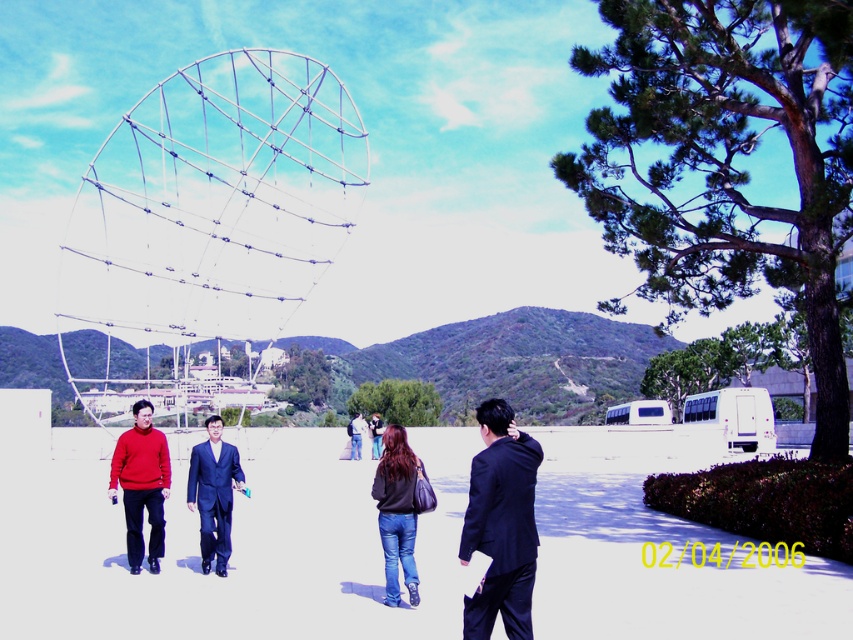
Between black suit at center and matte red sweater at lower left, which one is positioned higher?

black suit at center is higher up.

Is point (488, 628) farther from camera compared to point (157, 465)?

That is False.

Who is more forward, (500,570) or (144,484)?

Point (500,570)

Locate an element on the screen. black suit at center is located at coordinates (502, 524).

Can you confirm if matte red sweater at lower left is shorter than blue suit at center?

No.

The width and height of the screenshot is (853, 640). Describe the element at coordinates (141, 484) in the screenshot. I see `matte red sweater at lower left` at that location.

Image resolution: width=853 pixels, height=640 pixels. I want to click on matte red sweater at lower left, so click(x=141, y=484).

Between matte red sweater at lower left and dark blue suit at center, which one has less height?

With less height is dark blue suit at center.

Is matte red sweater at lower left bigger than dark blue suit at center?

Yes, matte red sweater at lower left is bigger than dark blue suit at center.

Image resolution: width=853 pixels, height=640 pixels. Find the location of `matte red sweater at lower left`. matte red sweater at lower left is located at coordinates click(x=141, y=484).